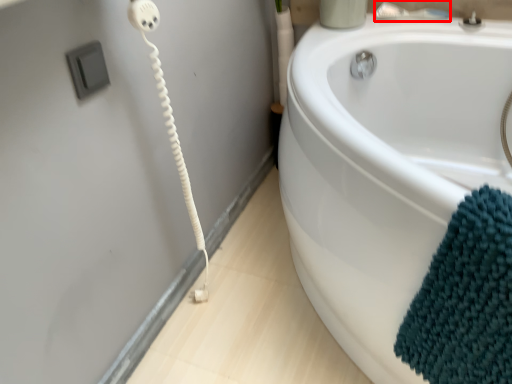
Question: From the image's perspective, where is faucet (annotated by the red box) located in relation to bath towel in the image?

Choices:
 (A) above
 (B) below

Answer: (A)